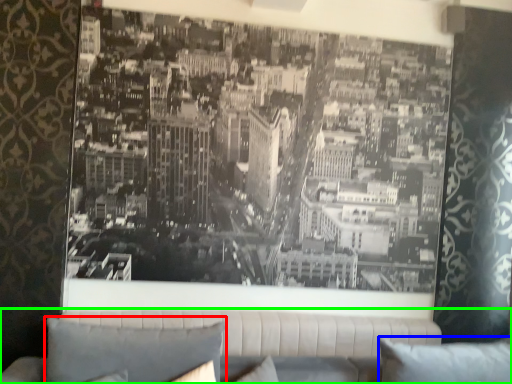
Question: Which is nearer to the pillow (highlighted by a red box)? pillow (highlighted by a blue box) or studio couch (highlighted by a green box).

Choices:
 (A) pillow
 (B) studio couch

Answer: (B)